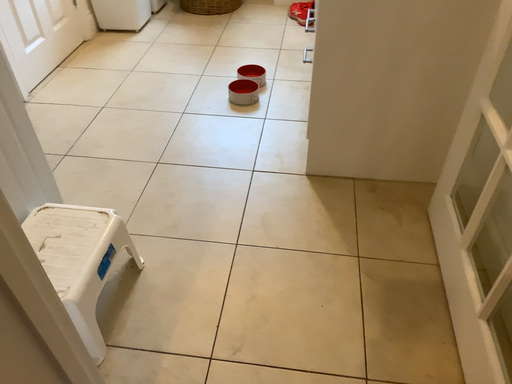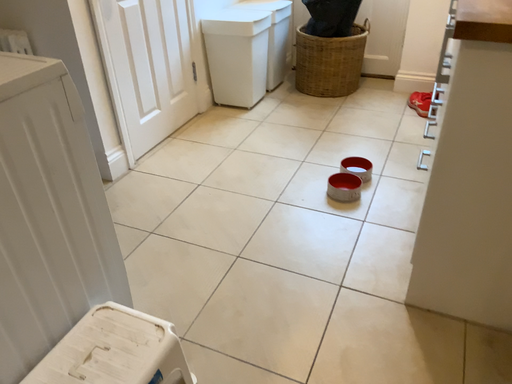
Question: Which way did the camera rotate in the video?

Choices:
 (A) rotated right
 (B) rotated left

Answer: (B)